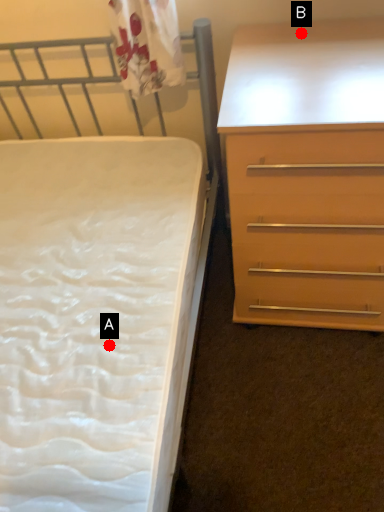
Question: Two points are circled on the image, labeled by A and B beside each circle. Which of the following is the closest to the observer?

Choices:
 (A) A is closer
 (B) B is closer

Answer: (A)